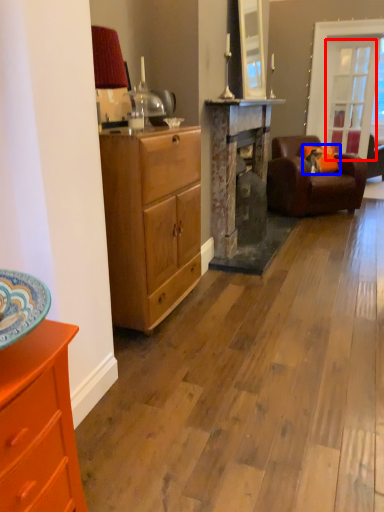
Question: Which object is closer to the camera taking this photo, glass door (highlighted by a red box) or pillow (highlighted by a blue box)?

Choices:
 (A) glass door
 (B) pillow

Answer: (B)